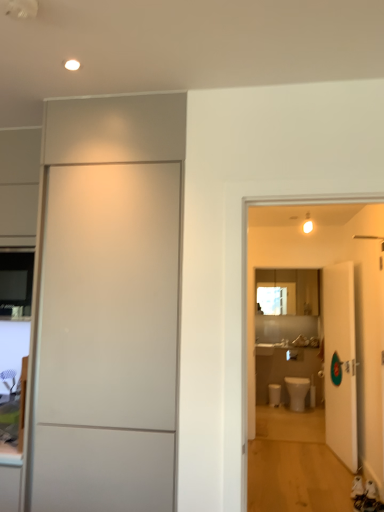
Question: From the image's perspective, is white glossy toilet at center on white matte door at left, arranged as the 2th door when viewed from the right?

Choices:
 (A) yes
 (B) no

Answer: (B)

Question: From a real-world perspective, is white glossy toilet at center positioned over white matte door at left, which is counted as the 1th door, starting from the left, based on gravity?

Choices:
 (A) no
 (B) yes

Answer: (A)

Question: From the image's perspective, would you say white glossy toilet at center is shown under white matte door at left, which is counted as the 1th door, starting from the left?

Choices:
 (A) no
 (B) yes

Answer: (B)

Question: Would you say white glossy toilet at center is a long distance from white matte door at left, which is counted as the 1th door, starting from the left?

Choices:
 (A) no
 (B) yes

Answer: (B)

Question: Does white glossy toilet at center have a lesser height compared to white matte door at left, arranged as the 2th door when viewed from the right?

Choices:
 (A) no
 (B) yes

Answer: (B)

Question: Looking at their shapes, would you say white glossy toilet bowl at lower center is wider or thinner than white glossy toilet at center?

Choices:
 (A) thin
 (B) wide

Answer: (A)

Question: Is white glossy toilet bowl at lower center situated inside white glossy toilet at center or outside?

Choices:
 (A) outside
 (B) inside

Answer: (A)

Question: In the image, is white glossy toilet bowl at lower center positioned in front of or behind white glossy toilet at center?

Choices:
 (A) behind
 (B) front

Answer: (A)

Question: Visually, is white glossy toilet bowl at lower center positioned to the left or to the right of white glossy toilet at center?

Choices:
 (A) right
 (B) left

Answer: (B)

Question: In the image, is white glossy toilet bowl at lower center on the left side or the right side of white glossy door at right, the first door when ordered from right to left?

Choices:
 (A) right
 (B) left

Answer: (B)

Question: Is white glossy toilet bowl at lower center in front of or behind white glossy door at right, positioned as the first door in back-to-front order, in the image?

Choices:
 (A) behind
 (B) front

Answer: (A)

Question: Considering the positions of white glossy toilet bowl at lower center and white glossy door at right, positioned as the first door in back-to-front order, in the image, is white glossy toilet bowl at lower center wider or thinner than white glossy door at right, positioned as the first door in back-to-front order,?

Choices:
 (A) wide
 (B) thin

Answer: (A)

Question: Would you say white glossy toilet bowl at lower center is inside or outside white glossy door at right, which is counted as the 2th door, starting from the front?

Choices:
 (A) outside
 (B) inside

Answer: (A)

Question: Is white glossy toilet bowl at lower center situated inside white matte door at left, which is counted as the 1th door, starting from the left, or outside?

Choices:
 (A) inside
 (B) outside

Answer: (B)

Question: Based on their positions, is white glossy toilet bowl at lower center located to the left or right of white matte door at left, the first door from the front?

Choices:
 (A) left
 (B) right

Answer: (B)